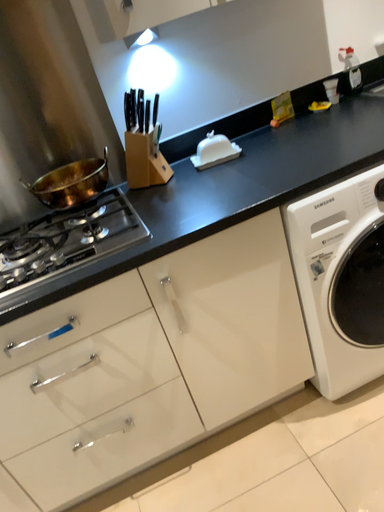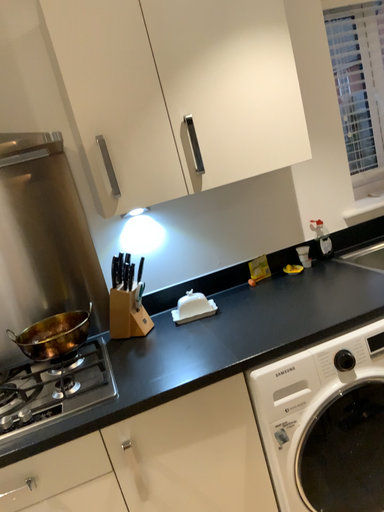
Question: Which way did the camera rotate in the video?

Choices:
 (A) rotated downward
 (B) rotated upward

Answer: (B)